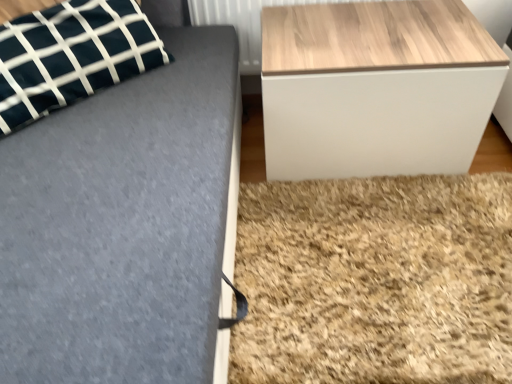
The width and height of the screenshot is (512, 384). Describe the element at coordinates (71, 56) in the screenshot. I see `dark green fabric pillow at upper left` at that location.

Image resolution: width=512 pixels, height=384 pixels. What are the coordinates of `wooden radiator at upper right` in the screenshot? It's located at (244, 22).

Which point is more distant from viewer, (287, 111) or (23, 123)?

The point (287, 111) is more distant.

Is wooden/textured table at right in front of or behind dark green fabric pillow at upper left in the image?

Visually, wooden/textured table at right is located behind dark green fabric pillow at upper left.

The image size is (512, 384). What are the coordinates of `pillow lying on the left of wooden/textured table at right` in the screenshot? It's located at (71, 56).

Which is more to the right, wooden/textured table at right or dark green fabric pillow at upper left?

Positioned to the right is wooden/textured table at right.

Consider the image. Is wooden radiator at upper right wider or thinner than wooden/textured table at right?

In the image, wooden radiator at upper right appears to be more narrow than wooden/textured table at right.

Between wooden radiator at upper right and wooden/textured table at right, which one has more height?

wooden/textured table at right is taller.

Is wooden radiator at upper right at the left side of wooden/textured table at right?

Yes, wooden radiator at upper right is to the left of wooden/textured table at right.

Which is correct: wooden radiator at upper right is inside wooden/textured table at right, or outside of it?

wooden radiator at upper right is located beyond the bounds of wooden/textured table at right.

Are dark green fabric pillow at upper left and wooden/textured table at right located far from each other?

dark green fabric pillow at upper left is near wooden/textured table at right, not far away.

Does dark green fabric pillow at upper left have a greater height compared to wooden/textured table at right?

No.

Which is more to the right, dark green fabric pillow at upper left or wooden/textured table at right?

Positioned to the right is wooden/textured table at right.

Is dark green fabric pillow at upper left bigger than wooden/textured table at right?

No, dark green fabric pillow at upper left is not bigger than wooden/textured table at right.

Looking at this image, is wooden radiator at upper right in contact with dark green fabric pillow at upper left?

No, wooden radiator at upper right is not touching dark green fabric pillow at upper left.

Is dark green fabric pillow at upper left a part of wooden radiator at upper right?

No, dark green fabric pillow at upper left is located outside of wooden radiator at upper right.

How different are the orientations of wooden radiator at upper right and dark green fabric pillow at upper left in degrees?

49.9 degrees.

Is point (270, 130) positioned in front of point (242, 67)?

Yes, point (270, 130) is in front of point (242, 67).

Based on the photo, considering the positions of objects wooden/textured table at right and wooden radiator at upper right in the image provided, who is more to the left, wooden/textured table at right or wooden radiator at upper right?

wooden radiator at upper right.

From a real-world perspective, is wooden/textured table at right physically above wooden radiator at upper right?

No, from a real-world perspective, wooden/textured table at right is not above wooden radiator at upper right.

Is dark green fabric pillow at upper left far away from wooden radiator at upper right?

No.

From the picture: Can you confirm if dark green fabric pillow at upper left is taller than wooden radiator at upper right?

Correct, dark green fabric pillow at upper left is much taller as wooden radiator at upper right.

Considering the sizes of dark green fabric pillow at upper left and wooden radiator at upper right in the image, is dark green fabric pillow at upper left wider or thinner than wooden radiator at upper right?

Considering their sizes, dark green fabric pillow at upper left looks broader than wooden radiator at upper right.

Where is `table below the dark green fabric pillow at upper left (from the image's perspective)`? This screenshot has width=512, height=384. table below the dark green fabric pillow at upper left (from the image's perspective) is located at coordinates (375, 88).

Where is `table below the wooden radiator at upper right (from a real-world perspective)`? table below the wooden radiator at upper right (from a real-world perspective) is located at coordinates (375, 88).

Estimate the real-world distances between objects in this image. Which object is closer to wooden/textured table at right, dark green fabric pillow at upper left or wooden radiator at upper right?

wooden radiator at upper right is positioned closer to the anchor wooden/textured table at right.

Looking at the image, which one is located further to wooden radiator at upper right, wooden/textured table at right or dark green fabric pillow at upper left?

The object further to wooden radiator at upper right is dark green fabric pillow at upper left.

Which object lies further to the anchor point dark green fabric pillow at upper left, wooden/textured table at right or wooden radiator at upper right?

wooden/textured table at right is positioned further to the anchor dark green fabric pillow at upper left.

Considering their positions, is dark green fabric pillow at upper left positioned closer to wooden radiator at upper right than wooden/textured table at right?

Based on the image, wooden/textured table at right appears to be nearer to wooden radiator at upper right.

Consider the image. Which object lies further to the anchor point wooden/textured table at right, wooden radiator at upper right or dark green fabric pillow at upper left?

dark green fabric pillow at upper left is further to wooden/textured table at right.

Looking at this image, estimate the real-world distances between objects in this image. Which object is closer to dark green fabric pillow at upper left, wooden radiator at upper right or wooden/textured table at right?

wooden radiator at upper right lies closer to dark green fabric pillow at upper left than the other object.

This screenshot has width=512, height=384. Find the location of `radiator between dark green fabric pillow at upper left and wooden/textured table at right from left to right`. radiator between dark green fabric pillow at upper left and wooden/textured table at right from left to right is located at coordinates (244, 22).